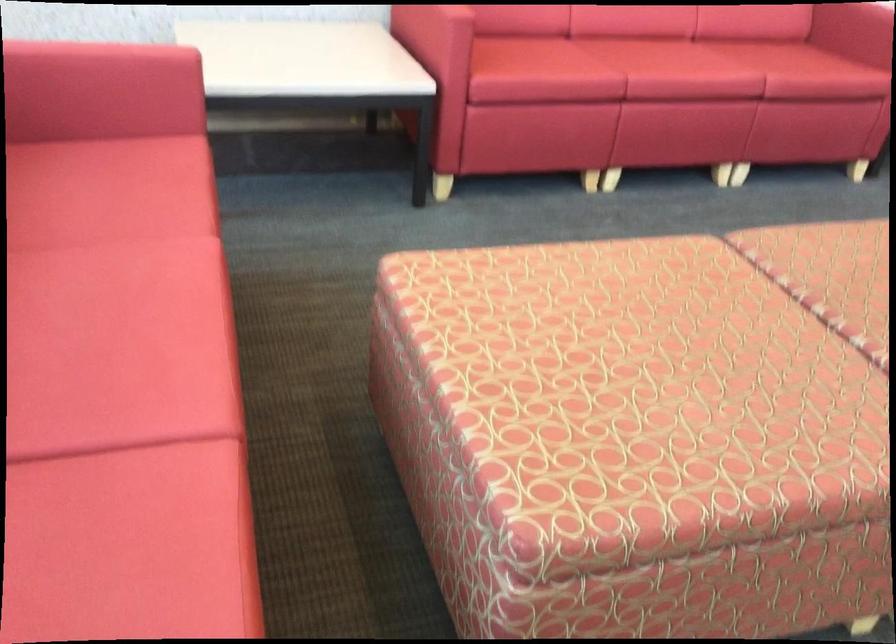
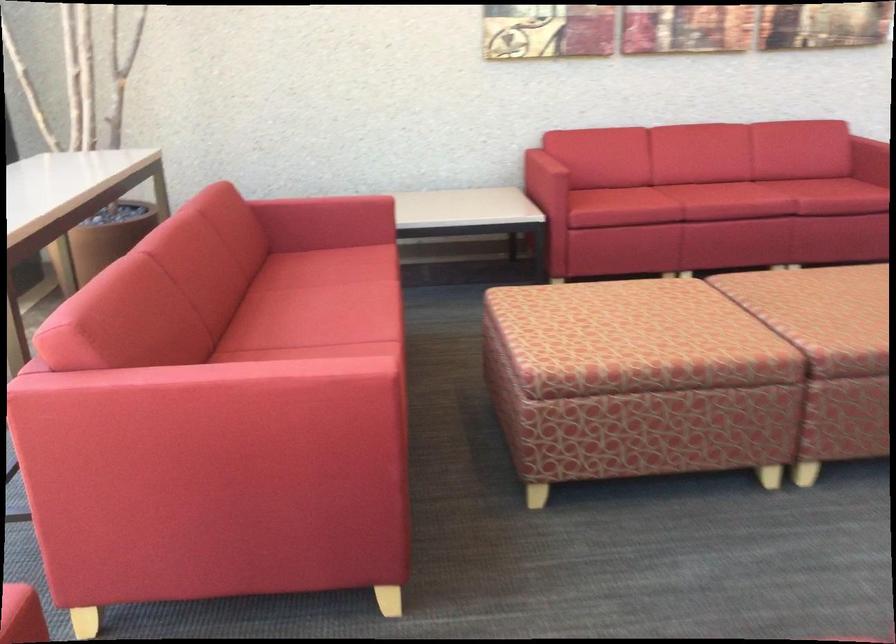
Locate, in the second image, the point that corresponds to (x=660, y=413) in the first image.

(627, 334)